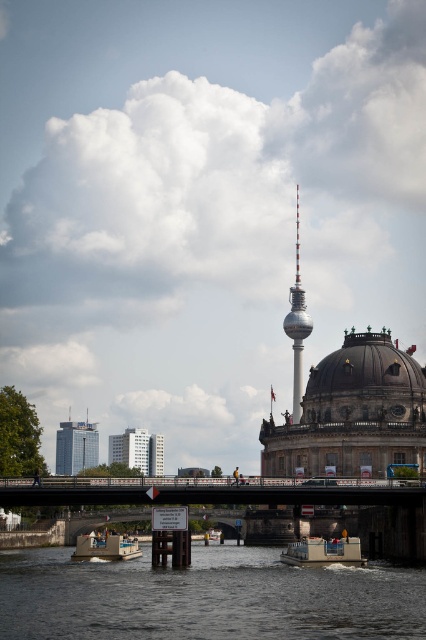
Is point (298, 186) closer to viewer compared to point (155, 460)?

No, it is behind (155, 460).

Can you confirm if silver metallic tower at center is smaller than white glass building at center?

No, silver metallic tower at center is not smaller than white glass building at center.

Is point (293, 387) positioned before point (112, 461)?

No, (293, 387) is behind (112, 461).

Locate an element on the screen. The image size is (426, 640). silver metallic tower at center is located at coordinates (296, 324).

Which is behind, point (138, 444) or point (290, 554)?

Positioned behind is point (138, 444).

Is white glass building at center further to the viewer compared to white plastic boat at lower center?

Yes.

Describe the element at coordinates (138, 451) in the screenshot. I see `white glass building at center` at that location.

Image resolution: width=426 pixels, height=640 pixels. Identify the location of white glass building at center. (138, 451).

Does metallic gray bridge at center appear under glassy steel skyscraper at left?

No.

Is the position of metallic gray bridge at center less distant than that of glassy steel skyscraper at left?

Yes, it is.

Identify the location of metallic gray bridge at center. [221, 493].

Where is `metallic gray bridge at center`? metallic gray bridge at center is located at coordinates (221, 493).